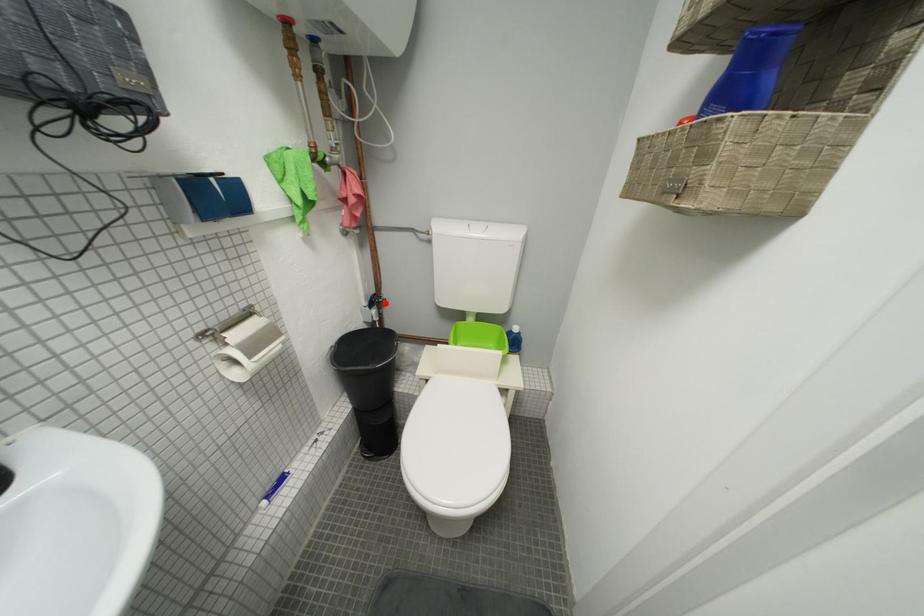
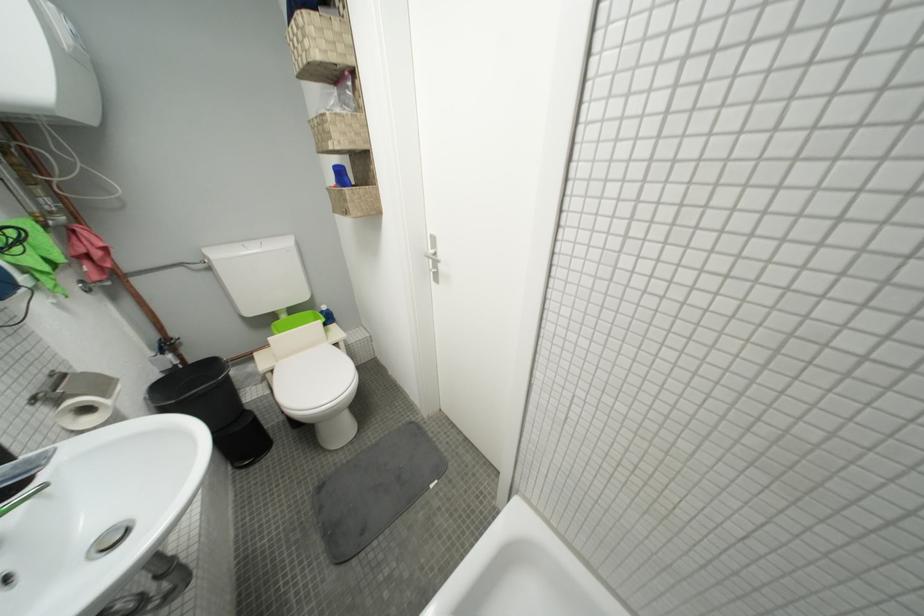
Locate, in the second image, the point that corresponds to the highlighted location in the first image.

(175, 347)